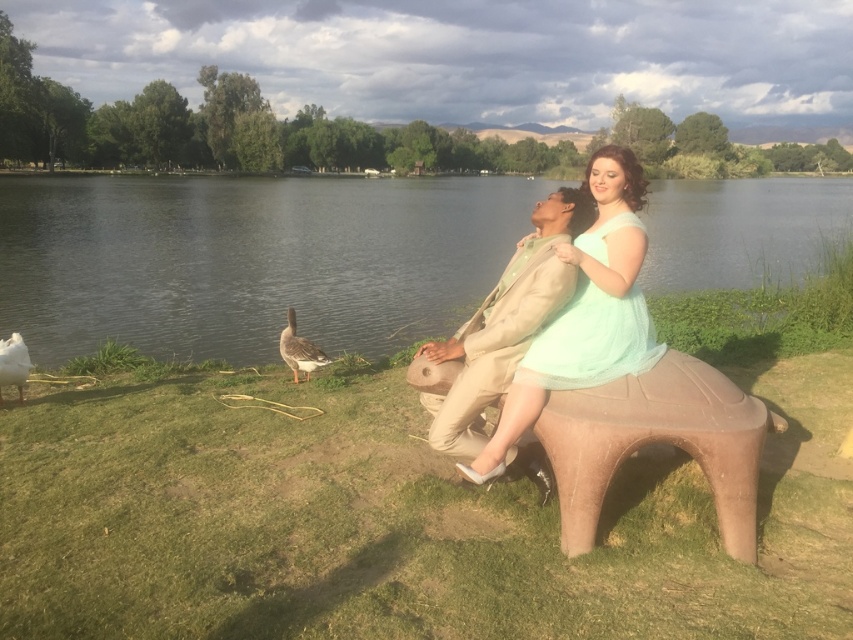
You are a photographer trying to capture a photo of the brown matte duck at lower center and the white matte duck at lower left. Which duck should you focus on if you want to highlight the taller one in your shot?

The brown matte duck at lower center is taller than the white matte duck at lower left, so you should focus on the brown matte duck at lower center to highlight its height in the photo.